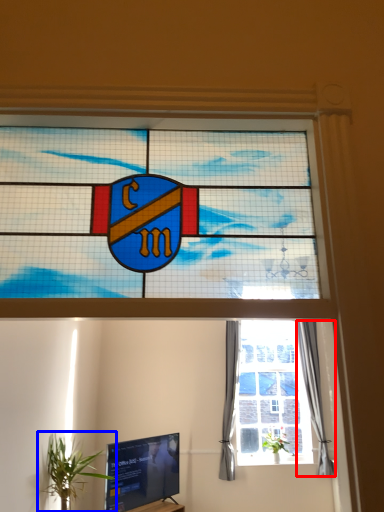
Question: Which point is further to the camera, curtain (highlighted by a red box) or houseplant (highlighted by a blue box)?

Choices:
 (A) curtain
 (B) houseplant

Answer: (A)